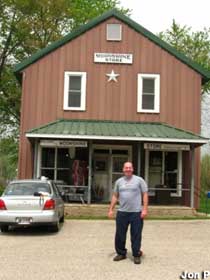
The width and height of the screenshot is (210, 280). Find the location of `window`. window is located at coordinates (73, 93).